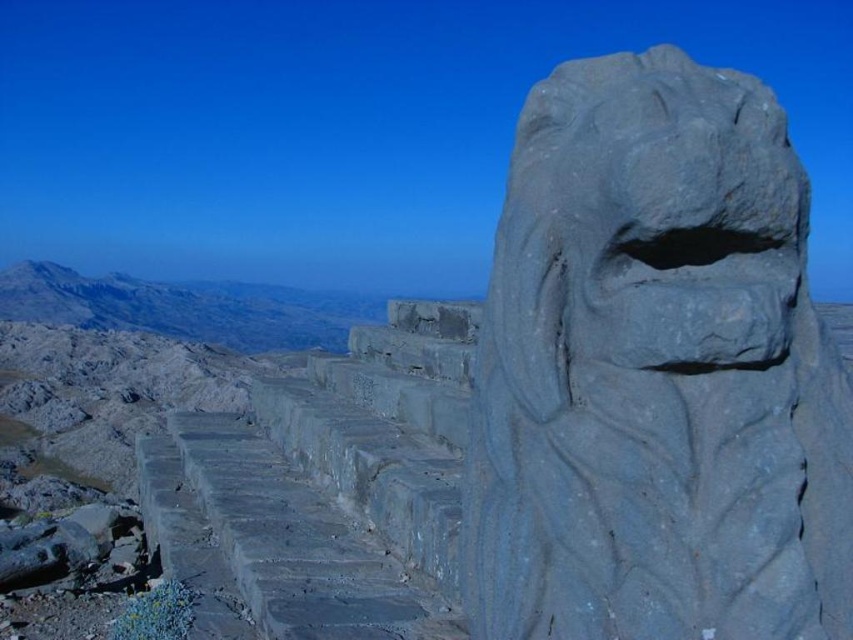
Question: Can you confirm if gray stone lion at right is thinner than rugged stone mountain at upper left?

Choices:
 (A) yes
 (B) no

Answer: (A)

Question: Which of the following is the farthest from the observer?

Choices:
 (A) rugged stone mountain at upper left
 (B) gray stone lion at right

Answer: (A)

Question: Is gray stone lion at right smaller than rugged stone mountain at upper left?

Choices:
 (A) yes
 (B) no

Answer: (A)

Question: Can you confirm if gray stone lion at right is positioned below rugged stone mountain at upper left?

Choices:
 (A) yes
 (B) no

Answer: (A)